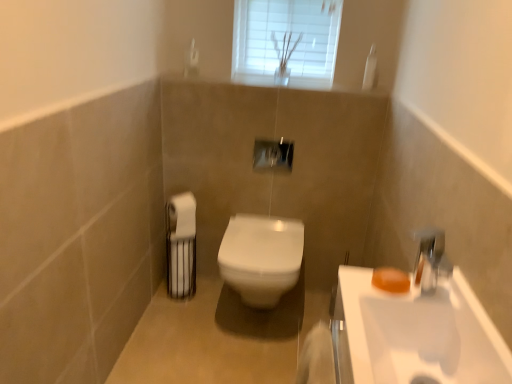
Question: Can you confirm if white glass window at upper center is positioned to the left of white glossy sink at lower right?

Choices:
 (A) yes
 (B) no

Answer: (A)

Question: Considering the relative sizes of white glass window at upper center and white glossy sink at lower right in the image provided, is white glass window at upper center thinner than white glossy sink at lower right?

Choices:
 (A) yes
 (B) no

Answer: (A)

Question: Is white glass window at upper center positioned behind white glossy sink at lower right?

Choices:
 (A) yes
 (B) no

Answer: (A)

Question: Is white glossy sink at lower right at the back of white glass window at upper center?

Choices:
 (A) no
 (B) yes

Answer: (A)

Question: Could you tell me if white glass window at upper center is turned towards white glossy sink at lower right?

Choices:
 (A) no
 (B) yes

Answer: (B)

Question: In the image, is white glossy sink at lower right positioned in front of or behind white glossy toilet at center?

Choices:
 (A) front
 (B) behind

Answer: (A)

Question: Considering the positions of white glossy sink at lower right and white glossy toilet at center in the image, is white glossy sink at lower right wider or thinner than white glossy toilet at center?

Choices:
 (A) wide
 (B) thin

Answer: (B)

Question: From a real-world perspective, is white glossy sink at lower right physically located above or below white glossy toilet at center?

Choices:
 (A) above
 (B) below

Answer: (A)

Question: In terms of height, does white glossy sink at lower right look taller or shorter compared to white glossy toilet at center?

Choices:
 (A) short
 (B) tall

Answer: (A)

Question: Considering the positions of white matte toilet paper at left and white glass window at upper center in the image, is white matte toilet paper at left taller or shorter than white glass window at upper center?

Choices:
 (A) tall
 (B) short

Answer: (B)

Question: From the image's perspective, is white matte toilet paper at left located above or below white glass window at upper center?

Choices:
 (A) above
 (B) below

Answer: (B)

Question: Is white matte toilet paper at left bigger or smaller than white glass window at upper center?

Choices:
 (A) small
 (B) big

Answer: (A)

Question: In the image, is white matte toilet paper at left on the left side or the right side of white glass window at upper center?

Choices:
 (A) right
 (B) left

Answer: (B)

Question: Would you say orange matte soap at right is to the left or to the right of white matte toilet paper at left in the picture?

Choices:
 (A) right
 (B) left

Answer: (A)

Question: Based on their sizes in the image, would you say orange matte soap at right is bigger or smaller than white matte toilet paper at left?

Choices:
 (A) small
 (B) big

Answer: (A)